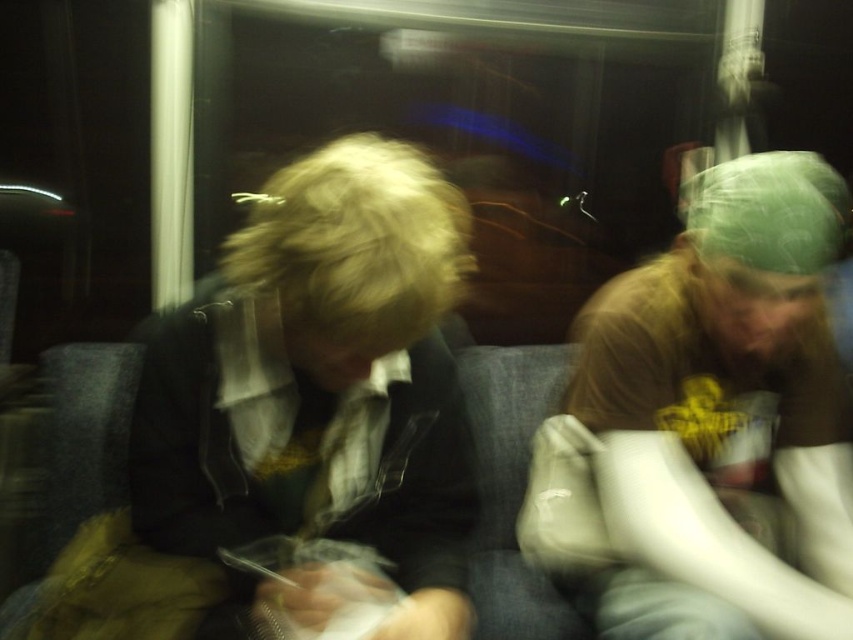
You are a delivery robot with a package that needs to pass between the green fabric cap at right and the matte black jacket at center. The robot is 16 inches wide. Can it fit through the space between them?

The distance between the green fabric cap at right and the matte black jacket at center is 15.40 inches. Since the robot is 16 inches wide, it cannot fit through the space between them.

You are a photographer trying to capture a candid shot of both the green fabric cap at right and the matte black jacket at center in the scene described. Given their sizes, which object should you focus on first to ensure it fits within your camera frame?

The green fabric cap at right is larger in width than the matte black jacket at center, so you should focus on capturing the green fabric cap at right first to ensure it fits within the camera frame before adjusting for the smaller matte black jacket at center.

What is located at the point with coordinates (709, 424)?

The green fabric cap at right is located at the point with coordinates (709, 424).